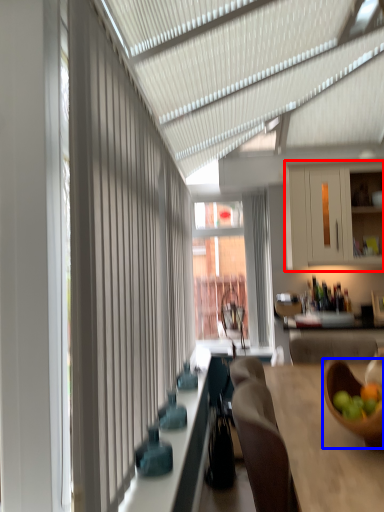
Question: Which object is closer to the camera taking this photo, cabinetry (highlighted by a red box) or bowl (highlighted by a blue box)?

Choices:
 (A) cabinetry
 (B) bowl

Answer: (B)